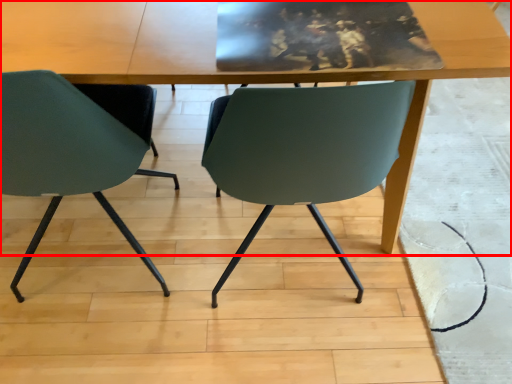
Question: From the image's perspective, where is table (annotated by the red box) located in relation to chair in the image?

Choices:
 (A) above
 (B) below

Answer: (A)